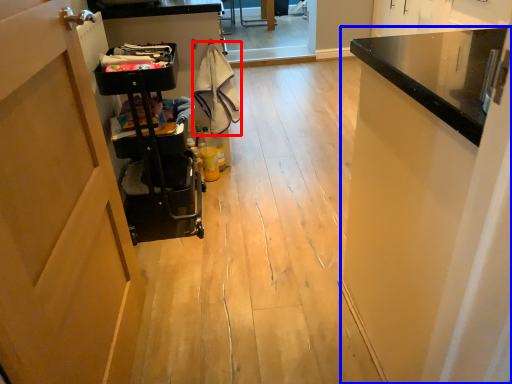
Question: Among these objects, which one is farthest to the camera, laundry (highlighted by a red box) or cabinetry (highlighted by a blue box)?

Choices:
 (A) laundry
 (B) cabinetry

Answer: (A)